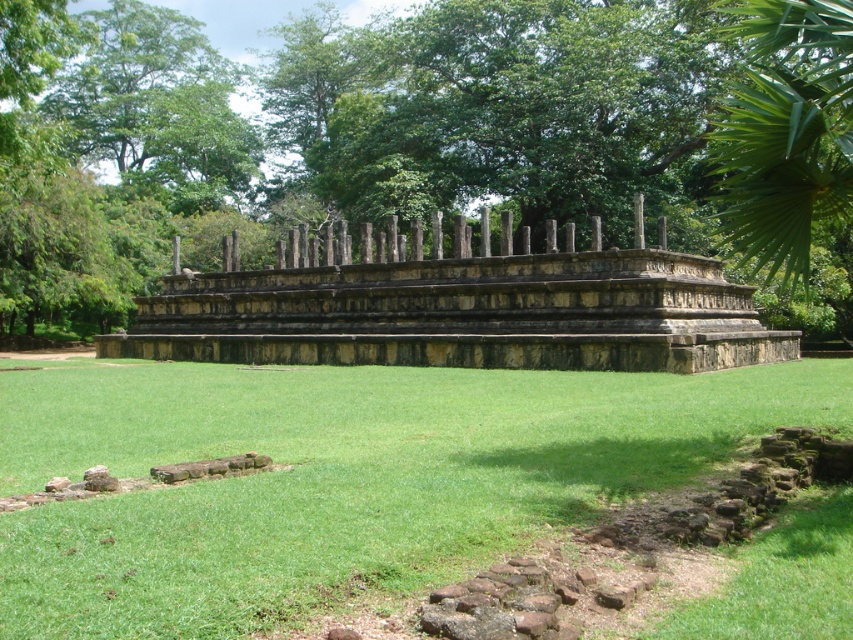
You are an archaeologist examining the ancient stone structure. You notice the green leafy tree at upper center and the stone ruins at center. Which object is bigger in size?

The green leafy tree at upper center is larger in size than the stone ruins at center.

You are standing at the origin point in the image. Which direction should you move to reach the stone ruins at center?

The stone ruins at center is located at point 0.492 on the x axis and 0.544 on the y axis, so you should move towards the center of the image to reach it.